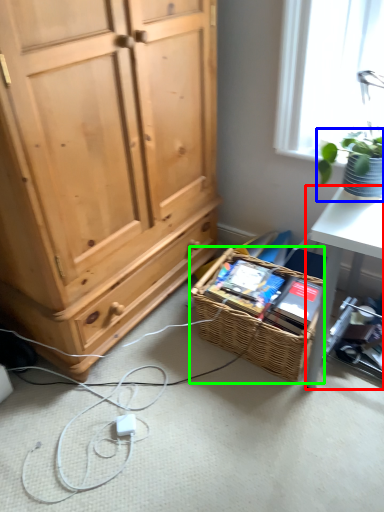
Question: Which object is positioned closest to desk (highlighted by a red box)? Select from houseplant (highlighted by a blue box) and picnic basket (highlighted by a green box).

Choices:
 (A) houseplant
 (B) picnic basket

Answer: (B)